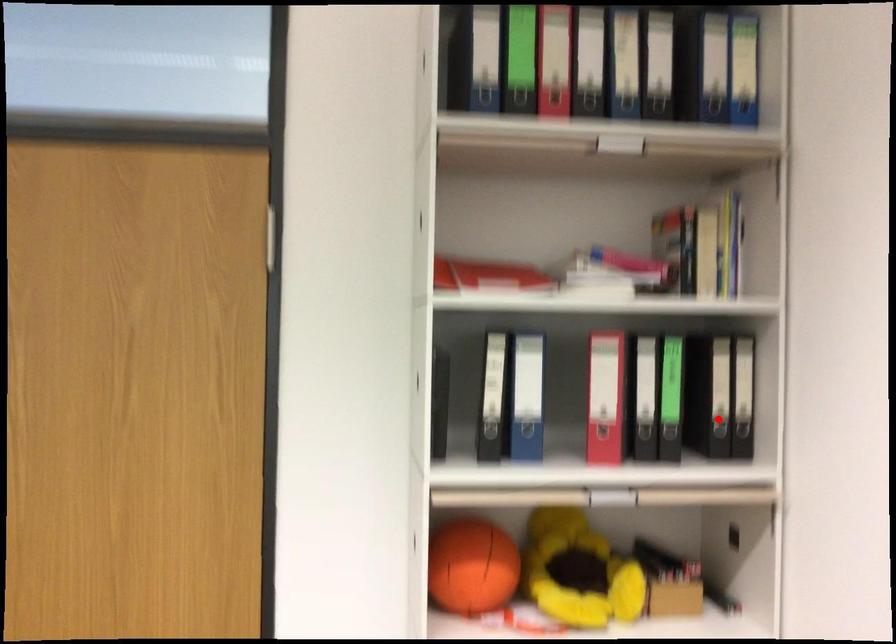
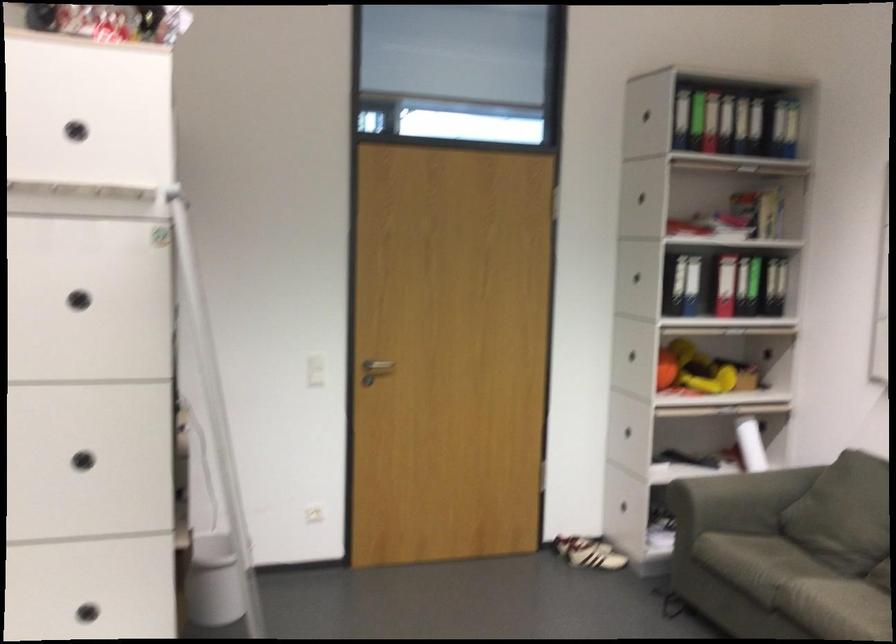
In the second image, find the point that corresponds to the highlighted location in the first image.

(773, 286)